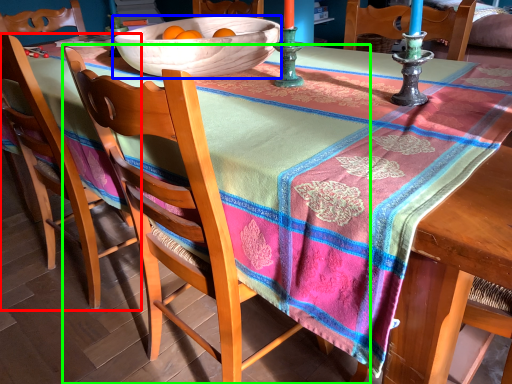
Question: Which object is positioned farthest from chair (highlighted by a red box)? Select from bowl (highlighted by a blue box) and chair (highlighted by a green box).

Choices:
 (A) bowl
 (B) chair

Answer: (A)